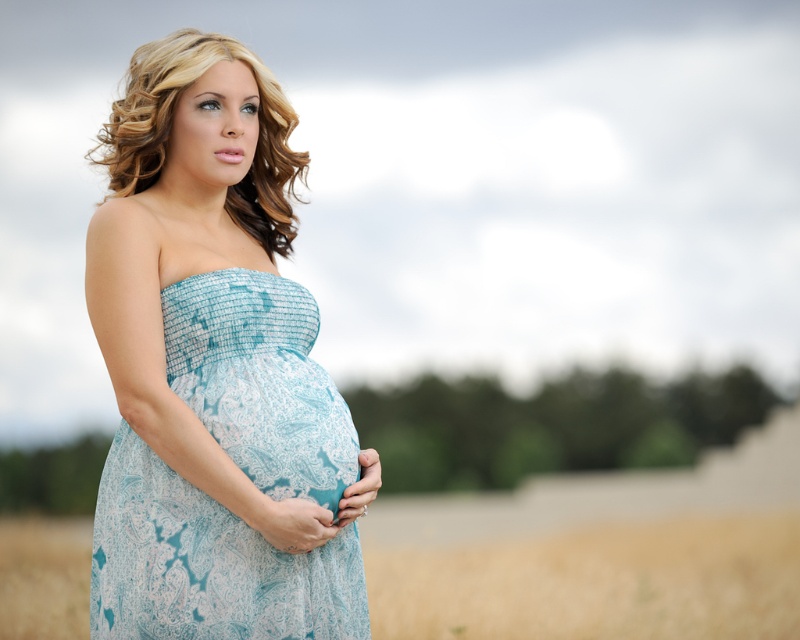
Looking at this image, between light blue lace dress at center and golden wheat field at lower center, which one appears on the right side from the viewer's perspective?

golden wheat field at lower center

Can you confirm if light blue lace dress at center is positioned to the left of golden wheat field at lower center?

Yes, light blue lace dress at center is to the left of golden wheat field at lower center.

Identify the location of light blue lace dress at center. Image resolution: width=800 pixels, height=640 pixels. (208, 563).